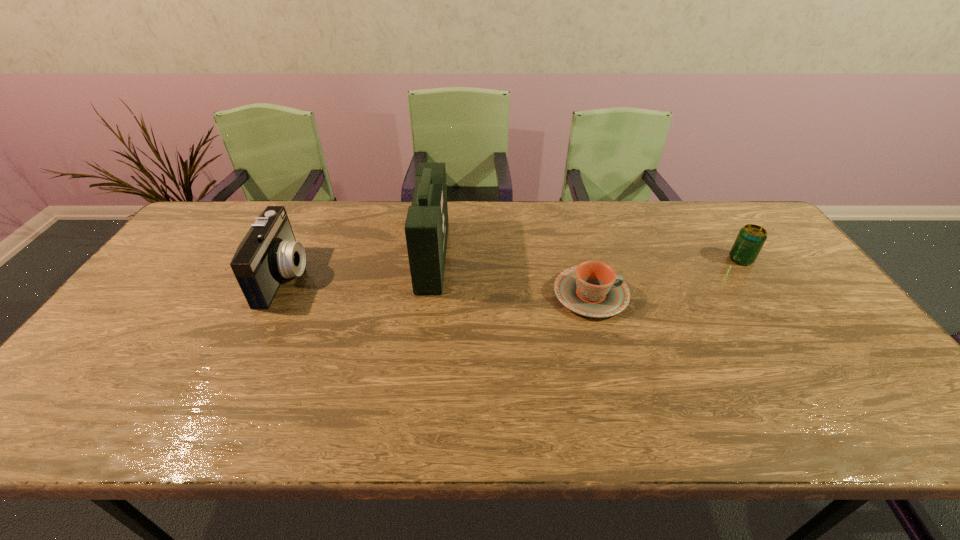
Where is `vacant space located on the left of the rightmost object`? vacant space located on the left of the rightmost object is located at coordinates (707, 259).

Where is `vacant space situated on the handle side of the chinaware`? vacant space situated on the handle side of the chinaware is located at coordinates (692, 294).

Identify the location of object that is at the far edge. (426, 228).

You are a GUI agent. You are given a task and a screenshot of the screen. Output one action in this format:
    pyautogui.click(x=<x>, y=<y>)
    Task: Click on the object positioned at the right edge
    
    Given the screenshot: What is the action you would take?
    pyautogui.click(x=751, y=238)

Locate an element on the screen. The width and height of the screenshot is (960, 540). free space at the far edge of the desktop is located at coordinates (260, 209).

Where is `vacant space at the left edge of the desktop`? vacant space at the left edge of the desktop is located at coordinates (176, 256).

Identify the location of vacant space at the far left corner of the desktop. (231, 223).

Find the location of a particular element. The height and width of the screenshot is (540, 960). vacant region between the first-aid kit and the shortest object is located at coordinates (512, 275).

You are a GUI agent. You are given a task and a screenshot of the screen. Output one action in this format:
    pyautogui.click(x=<x>, y=<y>)
    Task: Click on the vacant point located between the second object from right to left and the second shortest object
    Image resolution: width=960 pixels, height=540 pixels.
    Given the screenshot: What is the action you would take?
    pyautogui.click(x=666, y=277)

Identify the location of free space between the tallest object and the beer can. The height and width of the screenshot is (540, 960). (587, 258).